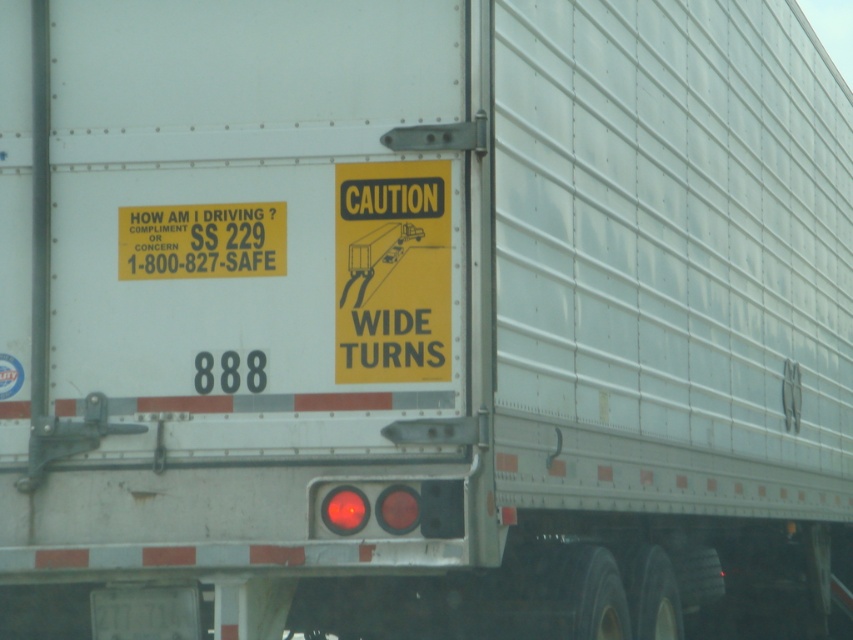
In the scene shown: You are a delivery driver who needs to secure a package on the trailer. The package is 2 meters wide. You have two options for placement areas near the yellow paper caution sign at center and the yellow paper sign at left. Which area can accommodate the package based on the width of the signs?

The yellow paper sign at left has a greater width than the yellow paper caution sign at center, so the area near the yellow paper sign at left can accommodate the 2 meter wide package.

You are a delivery driver who needs to attach a new sticker to the trailer. You have two options for placement. The first option is next to the yellow paper caution sign at center, and the second option is next to the white matte license plate at lower center. Which location will allow the sticker to be placed without overlapping either object?

The yellow paper caution sign at center has a lesser width compared to white matte license plate at lower center. Therefore, placing the sticker next to the yellow paper caution sign at center would provide more space to avoid overlapping since it is narrower than the license plate.